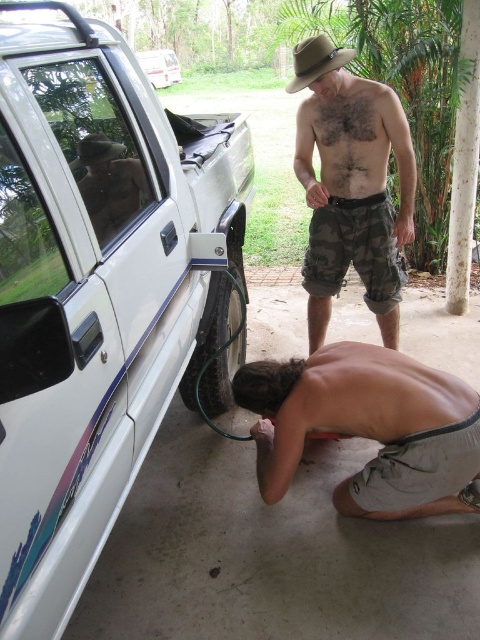
Question: Does camouflage shorts at center have a greater width compared to matte black car door at left?

Choices:
 (A) no
 (B) yes

Answer: (B)

Question: Does white matte vehicle at left have a greater width compared to matte black car door at left?

Choices:
 (A) no
 (B) yes

Answer: (B)

Question: Which object appears farthest from the camera in this image?

Choices:
 (A) black rubber tire at lower left
 (B) camouflage shorts at center

Answer: (A)

Question: Which point is closer to the camera?

Choices:
 (A) (196, 330)
 (B) (315, 45)

Answer: (A)

Question: Which object appears closest to the camera in this image?

Choices:
 (A) white plastic car at upper left
 (B) white matte vehicle at left
 (C) camouflage shorts at center
 (D) skinny white shorts at lower center

Answer: (B)

Question: Can you confirm if white matte vehicle at left is positioned to the right of camouflage shorts at center?

Choices:
 (A) yes
 (B) no

Answer: (B)